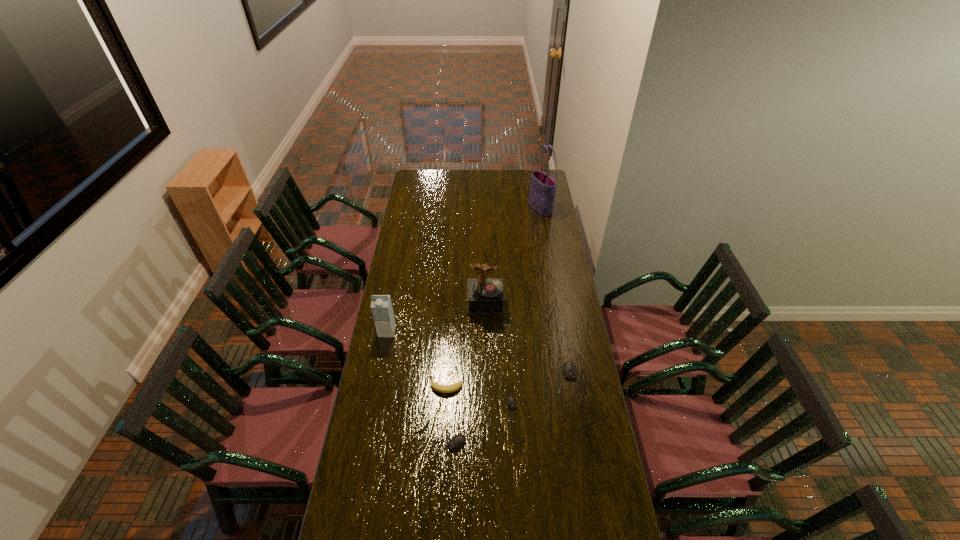
Where is `the farthest object`? the farthest object is located at coordinates (543, 187).

You are a GUI agent. You are given a task and a screenshot of the screen. Output one action in this format:
    pyautogui.click(x=<x>, y=<y>)
    Task: Click on the tallest object
    
    Given the screenshot: What is the action you would take?
    pyautogui.click(x=543, y=187)

Find the location of a particular element. banana is located at coordinates (435, 386).

Where is `vacant area situated 0.120m on the back of the nearest object`? This screenshot has height=540, width=960. vacant area situated 0.120m on the back of the nearest object is located at coordinates (450, 406).

Where is `free region located on the left of the second farthest mouse`? free region located on the left of the second farthest mouse is located at coordinates (450, 409).

Locate an element on the screen. vacant area situated 0.390m on the front of the rightmost mouse is located at coordinates (586, 496).

This screenshot has width=960, height=540. What are the coordinates of `free space located 0.280m on the front label of the fifth shortest object` in the screenshot? It's located at coord(375,393).

I want to click on free space located 0.340m at the horn opening of the second tallest object, so click(x=487, y=378).

The image size is (960, 540). I want to click on free space located 0.290m on the back of the farthest object, so click(x=535, y=176).

Find the location of a particular element. blank space located 0.340m on the right of the banana is located at coordinates pyautogui.click(x=546, y=386).